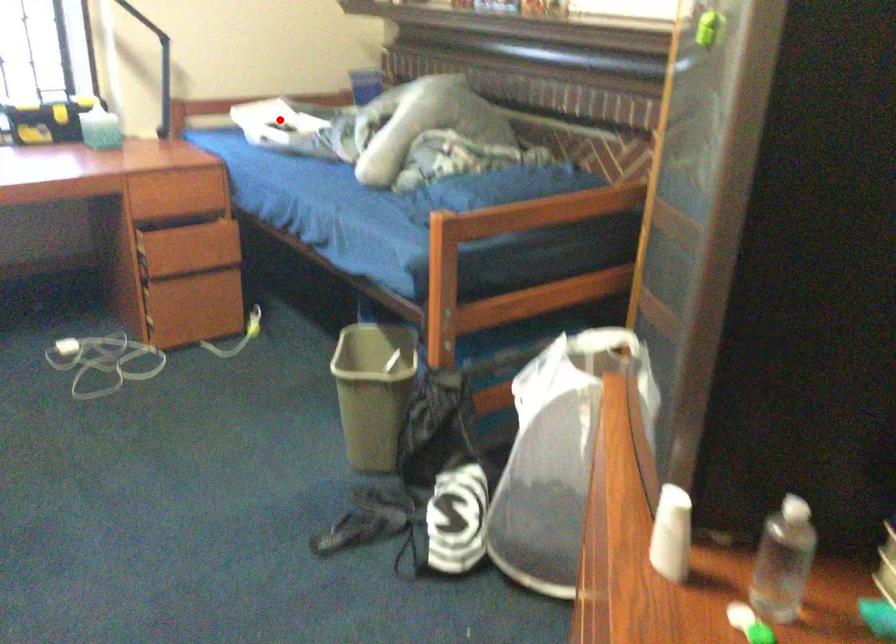
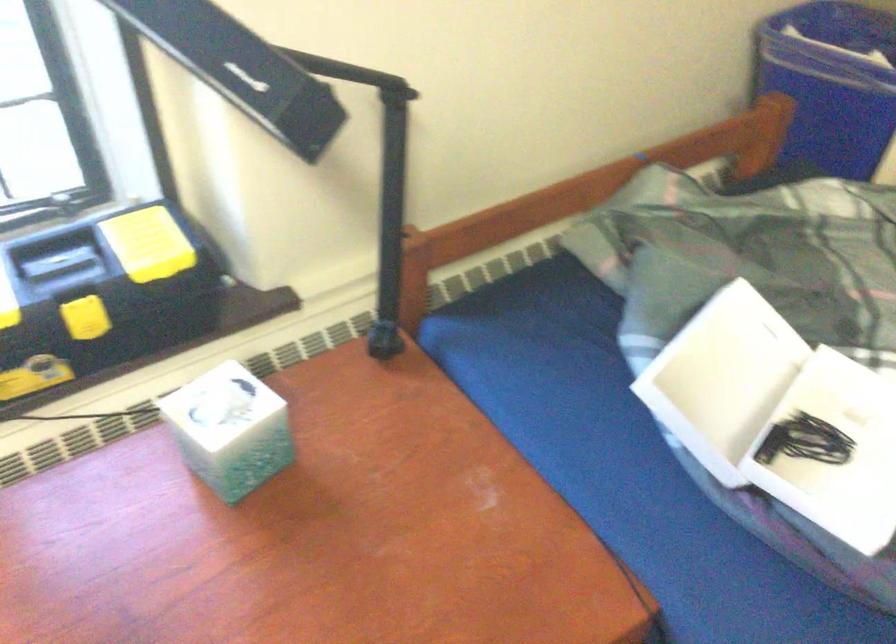
In the second image, find the point that corresponds to the highlighted location in the first image.

(728, 365)